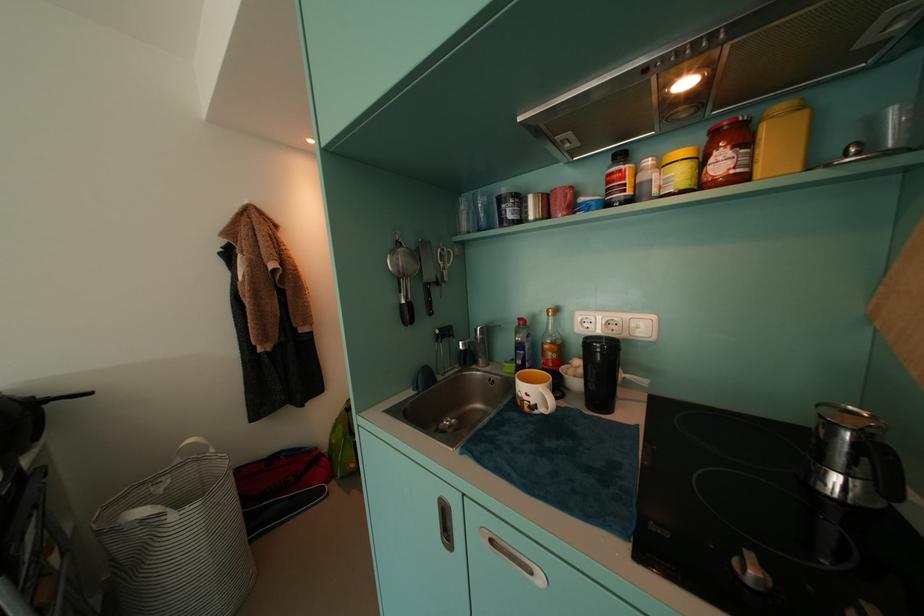
What do you see at coordinates (726, 124) in the screenshot? The width and height of the screenshot is (924, 616). I see `the red jar lid` at bounding box center [726, 124].